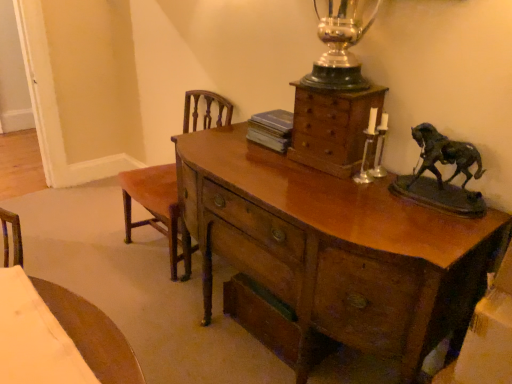
This screenshot has width=512, height=384. Identify the location of free spot above glossy wood desk at center (from a real-world perspective). (297, 181).